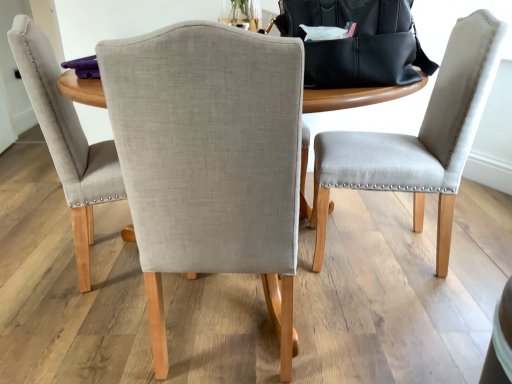
At what (x,y) coordinates should I click in order to perform the action: click on vacant area that is in front of light gray fabric chair at center, the 1th chair viewed from the left. Please return your answer as a coordinate pair (x, y). Looking at the image, I should click on (78, 330).